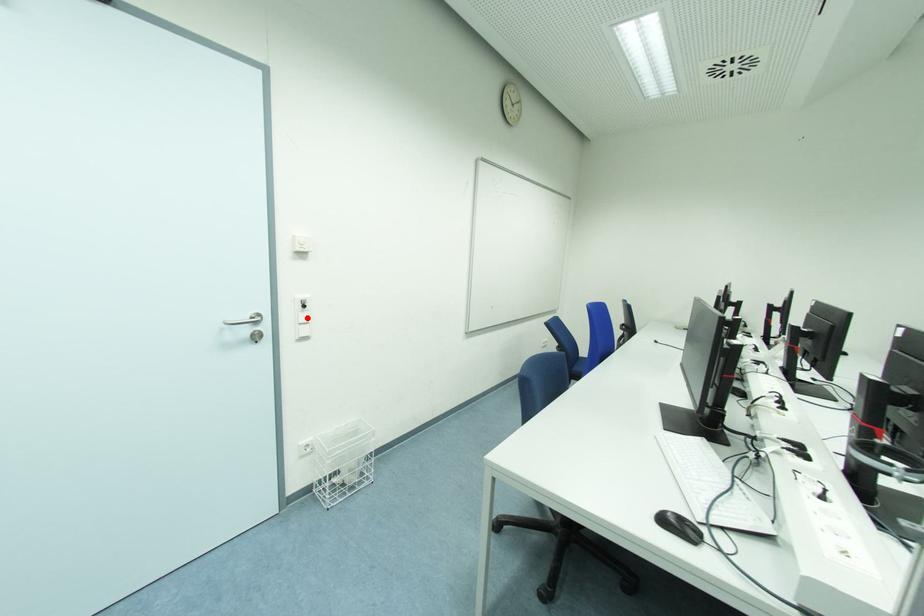
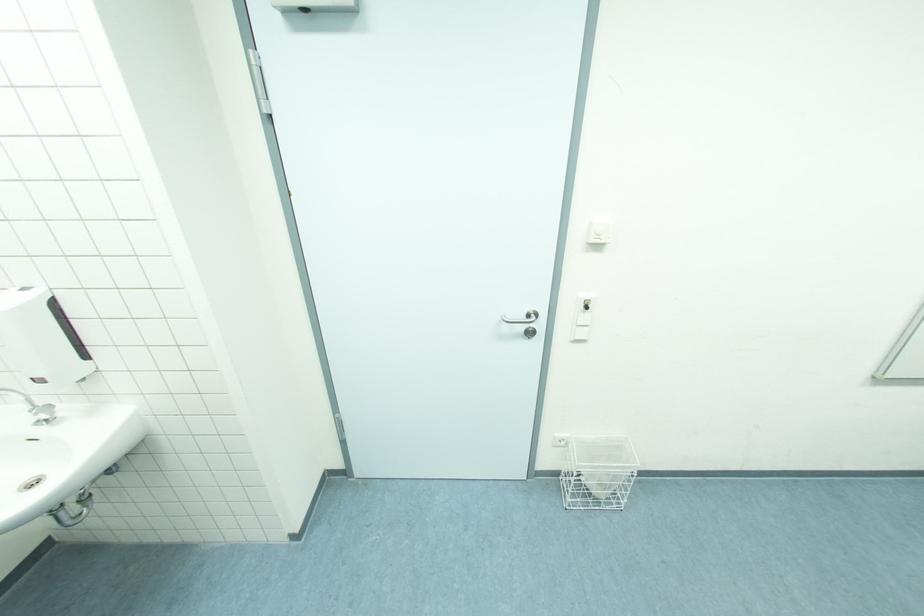
Find the pixel in the second image that matches the highlighted location in the first image.

(589, 318)